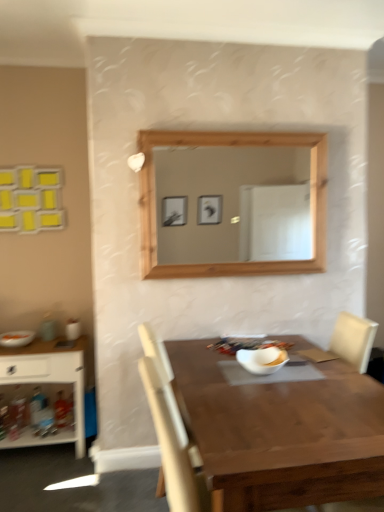
Image resolution: width=384 pixels, height=512 pixels. In order to click on free space to the right of white matte bowl at center, the first food when ordered from right to left in this screenshot , I will do `click(307, 373)`.